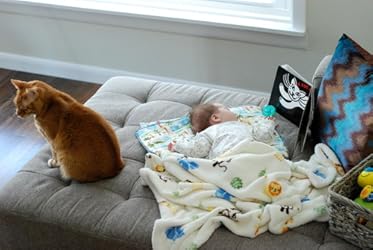
Where is `pillow`? pillow is located at coordinates (348, 105).